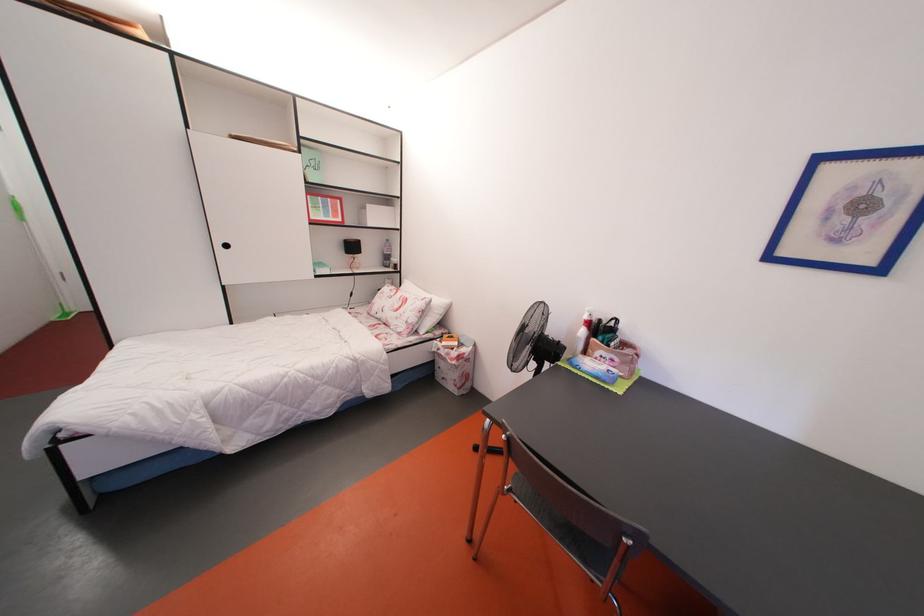
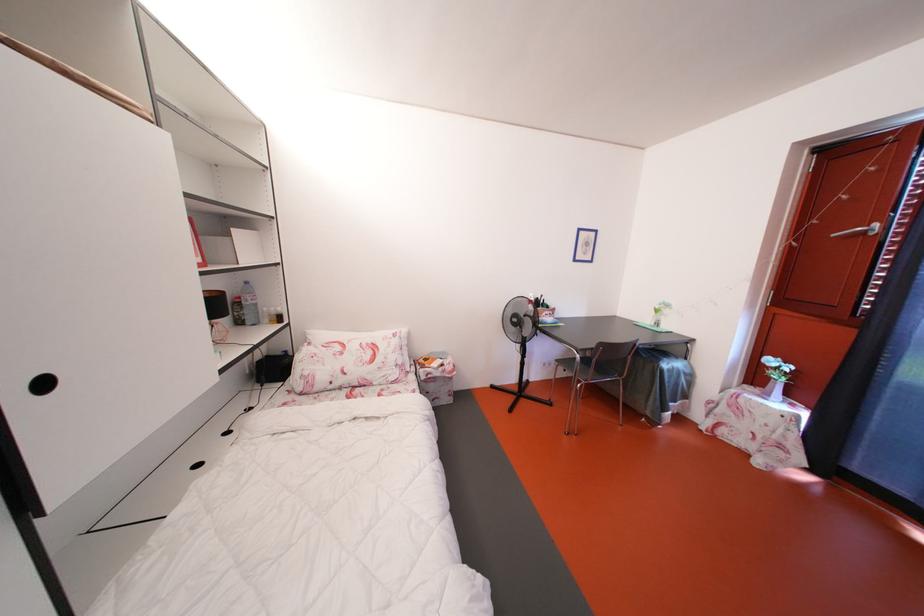
The point at (450, 360) is marked in the first image. Where is the corresponding point in the second image?

(444, 379)